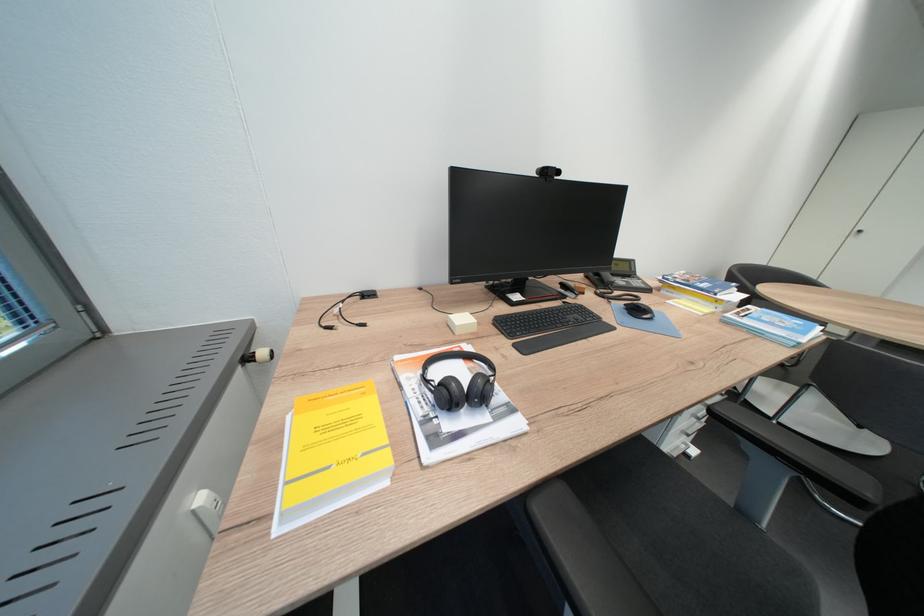
Find where to sit the black chair sitting surface. Please return your answer as a coordinate pair (x, y).

(828, 424)